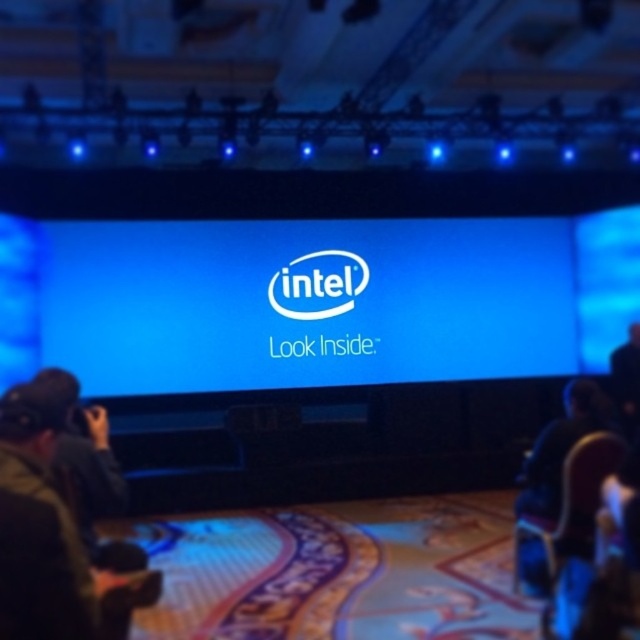
You are an event organizer who needs to place a decorative banner between the blue glossy screen at center and the white smooth logo at center. Given that the banner must be narrower than the narrower of the two, which object determines the maximum width of the banner?

The white smooth logo at center is narrower than the blue glossy screen at center. Therefore, the banner must be narrower than the white smooth logo at center to fit between them.

You are an attendee at the event and want to take a photo of the white smooth logo at center without the blue glossy screen at center blocking the view. Is this possible given their positions?

The blue glossy screen at center is closer to the viewer than the white smooth logo at center, so the screen would block the view of the logo. Therefore, it is not possible to take a photo of the white smooth logo at center without the blue glossy screen at center blocking the view.